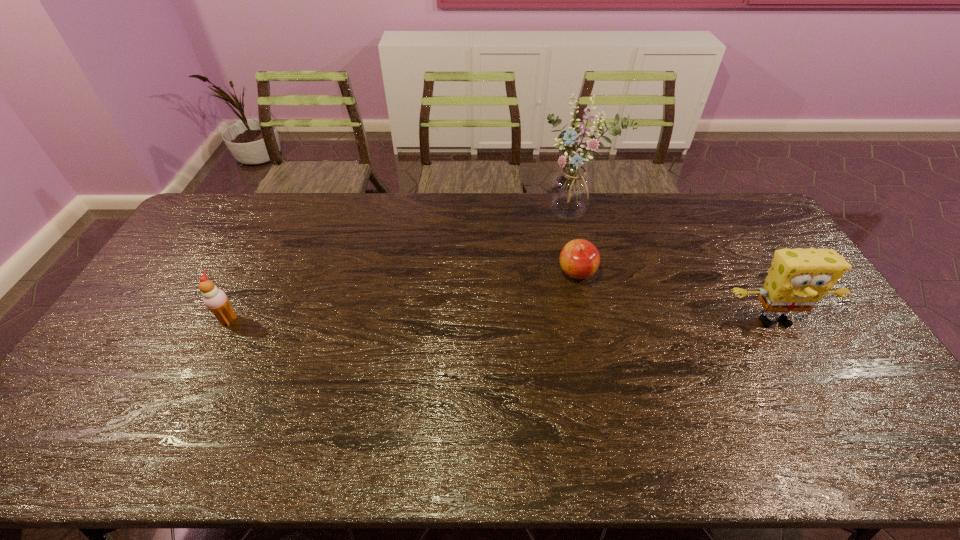
Find the location of a particular element. vacant space on the desktop that is between the icecream and the sponge and is positioned on the front-facing side of the bouquet is located at coordinates (565, 321).

Where is `vacant space on the desktop that is between the second shortest object and the rightmost object and is positioned on the stem of the second farthest object`? vacant space on the desktop that is between the second shortest object and the rightmost object and is positioned on the stem of the second farthest object is located at coordinates (564, 321).